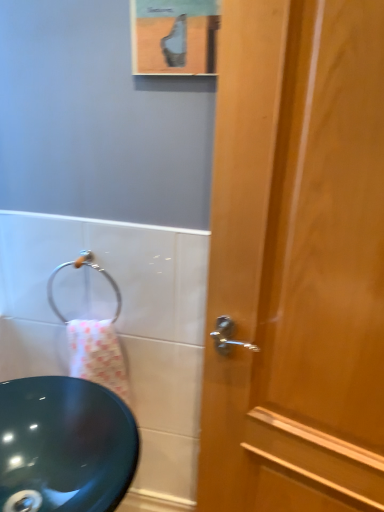
Question: Is matte black sink at left closer to camera compared to silver metallic towel ring at lower left?

Choices:
 (A) no
 (B) yes

Answer: (B)

Question: Is matte black sink at left wider than silver metallic towel ring at lower left?

Choices:
 (A) no
 (B) yes

Answer: (A)

Question: Considering the relative sizes of matte black sink at left and silver metallic towel ring at lower left in the image provided, is matte black sink at left smaller than silver metallic towel ring at lower left?

Choices:
 (A) yes
 (B) no

Answer: (B)

Question: Can we say matte black sink at left lies outside silver metallic towel ring at lower left?

Choices:
 (A) yes
 (B) no

Answer: (A)

Question: Is matte black sink at left at the right side of silver metallic towel ring at lower left?

Choices:
 (A) no
 (B) yes

Answer: (B)

Question: From the image's perspective, is silver metallic towel ring at lower left positioned above or below matte black sink at left?

Choices:
 (A) above
 (B) below

Answer: (A)

Question: Based on their positions, is silver metallic towel ring at lower left located to the left or right of matte black sink at left?

Choices:
 (A) right
 (B) left

Answer: (B)

Question: In the image, is silver metallic towel ring at lower left positioned in front of or behind matte black sink at left?

Choices:
 (A) behind
 (B) front

Answer: (A)

Question: Is silver metallic towel ring at lower left taller or shorter than matte black sink at left?

Choices:
 (A) tall
 (B) short

Answer: (B)

Question: From a real-world perspective, is wooden door at right above or below matte black sink at left?

Choices:
 (A) below
 (B) above

Answer: (B)

Question: Considering the positions of wooden door at right and matte black sink at left in the image, is wooden door at right taller or shorter than matte black sink at left?

Choices:
 (A) short
 (B) tall

Answer: (B)

Question: Is point click(x=296, y=481) positioned closer to the camera than point click(x=18, y=371)?

Choices:
 (A) farther
 (B) closer

Answer: (B)

Question: Relative to matte black sink at left, is wooden door at right in front or behind?

Choices:
 (A) behind
 (B) front

Answer: (B)

Question: From the image's perspective, relative to silver metallic towel ring at lower left, is wooden door at right above or below?

Choices:
 (A) above
 (B) below

Answer: (B)

Question: Is wooden door at right taller or shorter than silver metallic towel ring at lower left?

Choices:
 (A) short
 (B) tall

Answer: (B)